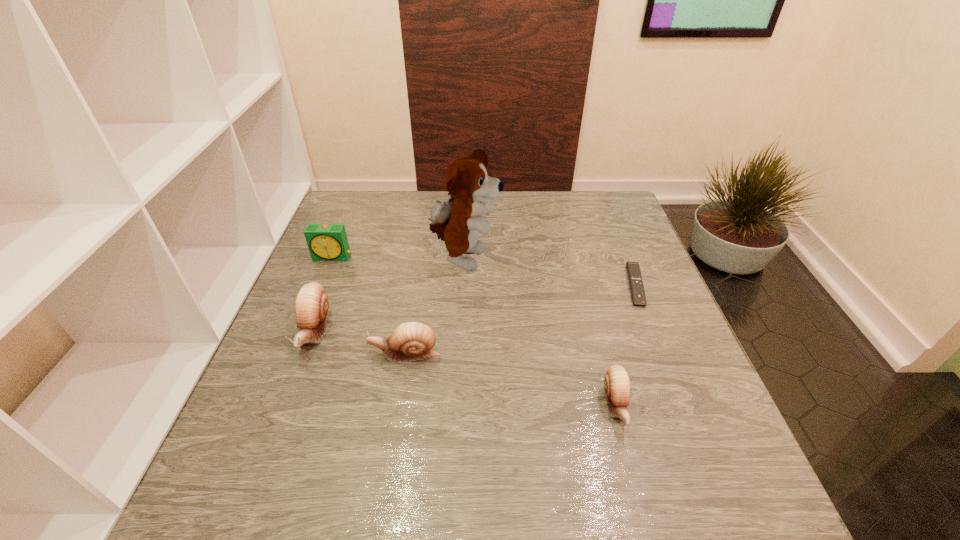
To ensure equal spacing by inserting another escargot among them, please point out a vacant spot for this new escargot. Please provide its 2D coordinates. Your answer should be formatted as a tuple, i.e. [(x, y)], where the tuple contains the x and y coordinates of a point satisfying the conditions above.

[(505, 379)]